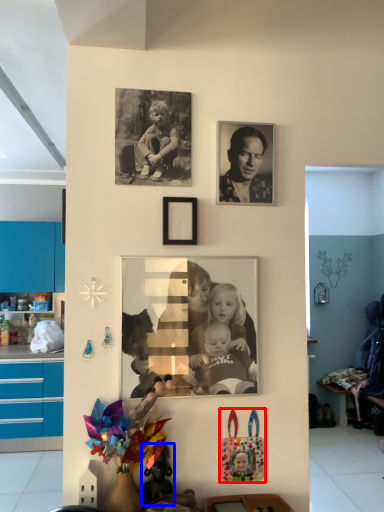
Question: Which object appears closest to the camera in this image, toy (highlighted by a red box) or toy (highlighted by a blue box)?

Choices:
 (A) toy
 (B) toy

Answer: (B)